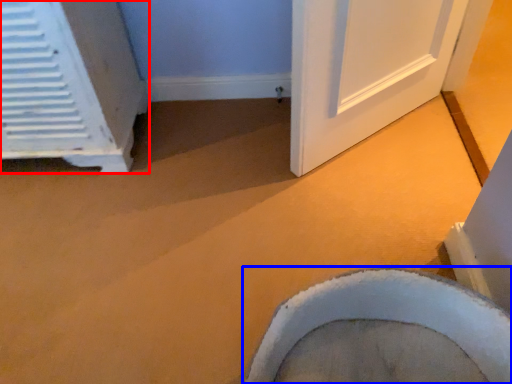
Question: Which point is further to the camera, air conditioning (highlighted by a red box) or toilet (highlighted by a blue box)?

Choices:
 (A) air conditioning
 (B) toilet

Answer: (A)